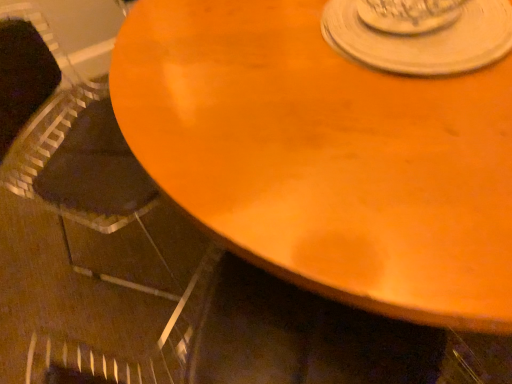
This screenshot has height=384, width=512. What are the coordinates of `black fabric armchair at left` in the screenshot? It's located at (76, 150).

Locate an element on the screen. The image size is (512, 384). black fabric armchair at left is located at coordinates (76, 150).

Can you confirm if black fabric armchair at left is shorter than wooden table at center?

In fact, black fabric armchair at left may be taller than wooden table at center.

From a real-world perspective, who is located higher, black fabric armchair at left or wooden table at center?

black fabric armchair at left.

Does point (74, 178) come farther from viewer compared to point (450, 301)?

Yes, point (74, 178) is behind point (450, 301).

From the image's perspective, is black fabric armchair at left positioned above or below wooden table at center?

Based on their image positions, black fabric armchair at left is located beneath wooden table at center.

Can you tell me how much wooden table at center and black fabric armchair at left differ in facing direction?

The angle between the facing direction of wooden table at center and the facing direction of black fabric armchair at left is 57.7 degrees.

Which object is positioned more to the left, wooden table at center or black fabric armchair at left?

From the viewer's perspective, black fabric armchair at left appears more on the left side.

Which is less distant, (196, 117) or (91, 166)?

The point (196, 117) is in front.

The image size is (512, 384). Identify the location of armchair on the left of the white matte saucer at upper center. (76, 150).

Is the depth of black fabric armchair at left greater than that of white matte saucer at upper center?

Yes, black fabric armchair at left is behind white matte saucer at upper center.

Is black fabric armchair at left surrounding white matte saucer at upper center?

Definitely not — white matte saucer at upper center is not inside black fabric armchair at left.

Can you confirm if wooden table at center is bigger than white matte saucer at upper center?

Yes.

How different are the orientations of wooden table at center and white matte saucer at upper center in degrees?

wooden table at center and white matte saucer at upper center are facing 90.5 degrees away from each other.

Which is more to the right, wooden table at center or white matte saucer at upper center?

wooden table at center.

From a real-world perspective, between wooden table at center and white matte saucer at upper center, who is vertically higher?

white matte saucer at upper center is physically above.

Is white matte saucer at upper center shorter than black fabric armchair at left?

Yes.

Is black fabric armchair at left located within white matte saucer at upper center?

No, white matte saucer at upper center does not contain black fabric armchair at left.

Is white matte saucer at upper center looking in the opposite direction of black fabric armchair at left?

That's not correct — white matte saucer at upper center is not looking away from black fabric armchair at left.

Does white matte saucer at upper center come in front of black fabric armchair at left?

Yes, white matte saucer at upper center is closer to the camera.

Which object is thinner, white matte saucer at upper center or wooden table at center?

white matte saucer at upper center.

Consider the image. Which is farther, (x=380, y=51) or (x=506, y=72)?

The point (x=380, y=51) is farther.

Locate an element on the screen. Image resolution: width=512 pixels, height=384 pixels. table that is in front of the white matte saucer at upper center is located at coordinates (325, 157).

Is white matte saucer at upper center far away from wooden table at center?

white matte saucer at upper center is actually quite close to wooden table at center.

Where is `table lying in front of the black fabric armchair at left`? This screenshot has height=384, width=512. table lying in front of the black fabric armchair at left is located at coordinates (325, 157).

Locate an element on the screen. This screenshot has height=384, width=512. armchair behind the wooden table at center is located at coordinates (76, 150).

From the image, which object appears to be nearer to wooden table at center, black fabric armchair at left or white matte saucer at upper center?

white matte saucer at upper center is positioned closer to the anchor wooden table at center.

Estimate the real-world distances between objects in this image. Which object is closer to white matte saucer at upper center, black fabric armchair at left or wooden table at center?

The object closer to white matte saucer at upper center is wooden table at center.

In the scene shown: Which object lies nearer to the anchor point white matte saucer at upper center, wooden table at center or black fabric armchair at left?

Among the two, wooden table at center is located nearer to white matte saucer at upper center.

Estimate the real-world distances between objects in this image. Which object is further from wooden table at center, white matte saucer at upper center or black fabric armchair at left?

black fabric armchair at left is further to wooden table at center.

Considering their positions, is wooden table at center positioned further to black fabric armchair at left than white matte saucer at upper center?

The object further to black fabric armchair at left is white matte saucer at upper center.

Looking at the image, which one is located closer to black fabric armchair at left, white matte saucer at upper center or wooden table at center?

wooden table at center is positioned closer to the anchor black fabric armchair at left.

At what (x,y) coordinates should I click in order to perform the action: click on saucer located between black fabric armchair at left and wooden table at center in the left-right direction. Please return your answer as a coordinate pair (x, y). The height and width of the screenshot is (384, 512). Looking at the image, I should click on (420, 33).